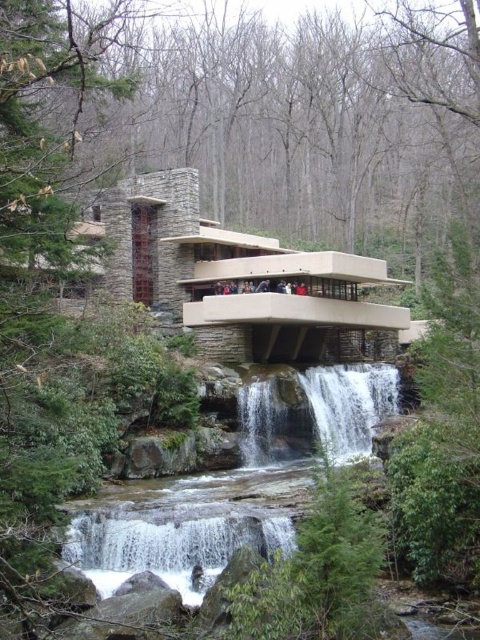
Is clear water at center wider than white textured water at center?

Correct, the width of clear water at center exceeds that of white textured water at center.

Describe the element at coordinates (195, 509) in the screenshot. The height and width of the screenshot is (640, 480). I see `clear water at center` at that location.

Which is behind, point (286, 544) or point (322, 394)?

Point (322, 394)

Locate an element on the screen. Image resolution: width=480 pixels, height=640 pixels. clear water at center is located at coordinates [x=195, y=509].